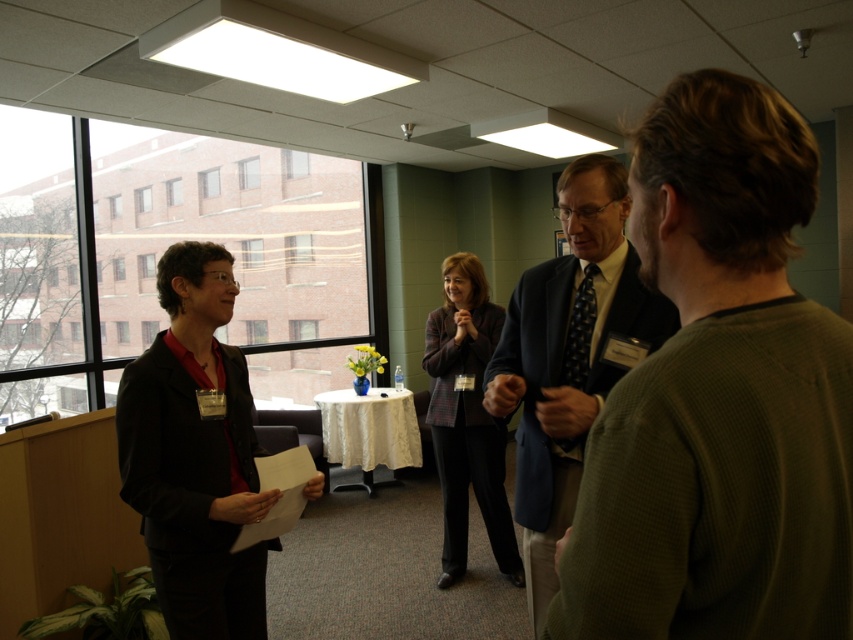
Question: Which of these objects is positioned farthest from the plaid fabric blazer at center?

Choices:
 (A) green textured sweater at right
 (B) black matte blazer at left
 (C) dark blue suit at center

Answer: (A)

Question: Which point is closer to the camera taking this photo?

Choices:
 (A) (529, 596)
 (B) (509, 522)
 (C) (167, 618)

Answer: (C)

Question: Is green textured sweater at right wider than dark blue suit at center?

Choices:
 (A) yes
 (B) no

Answer: (B)

Question: Can you confirm if dark blue suit at center is positioned above plaid fabric blazer at center?

Choices:
 (A) yes
 (B) no

Answer: (A)

Question: Among these points, which one is nearest to the camera?

Choices:
 (A) (561, 189)
 (B) (585, 624)

Answer: (B)

Question: Is dark blue suit at center smaller than plaid fabric blazer at center?

Choices:
 (A) yes
 (B) no

Answer: (A)